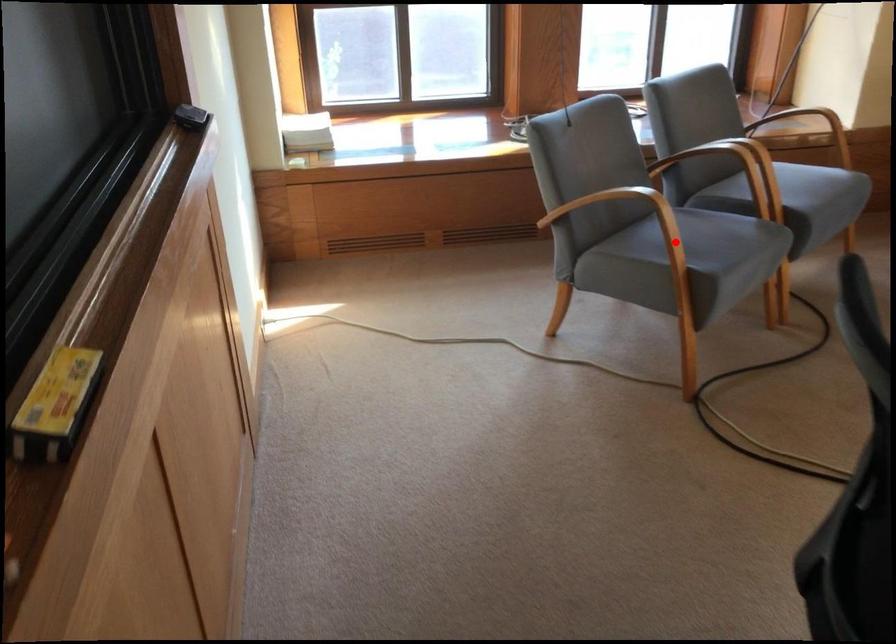
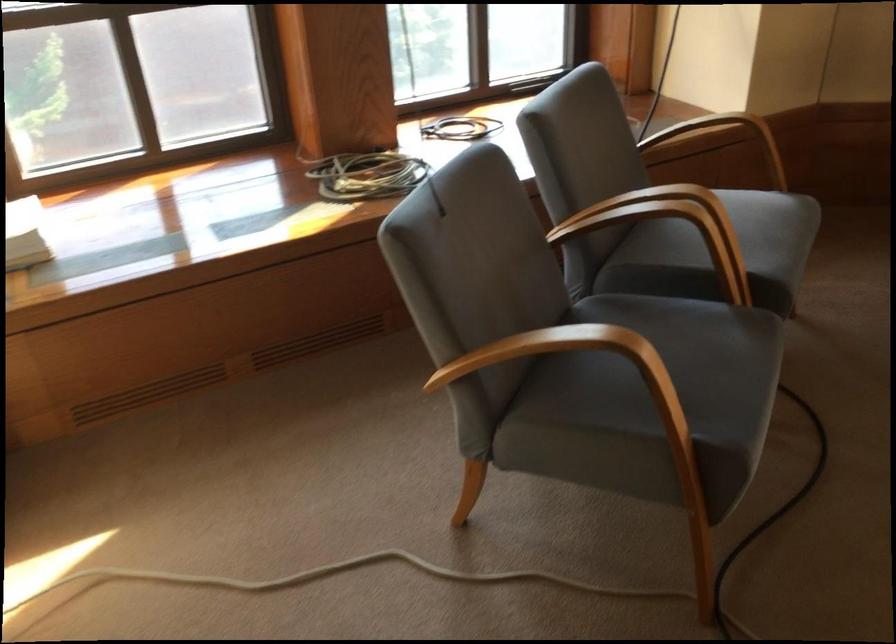
The point at the highlighted location is marked in the first image. Where is the corresponding point in the second image?

(650, 398)